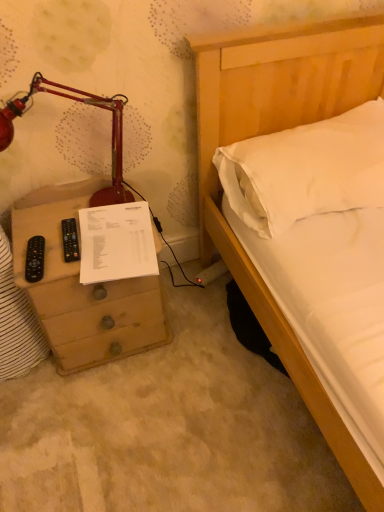
Locate an element on the screen. The width and height of the screenshot is (384, 512). free space behind black plastic remote at left is located at coordinates (68, 215).